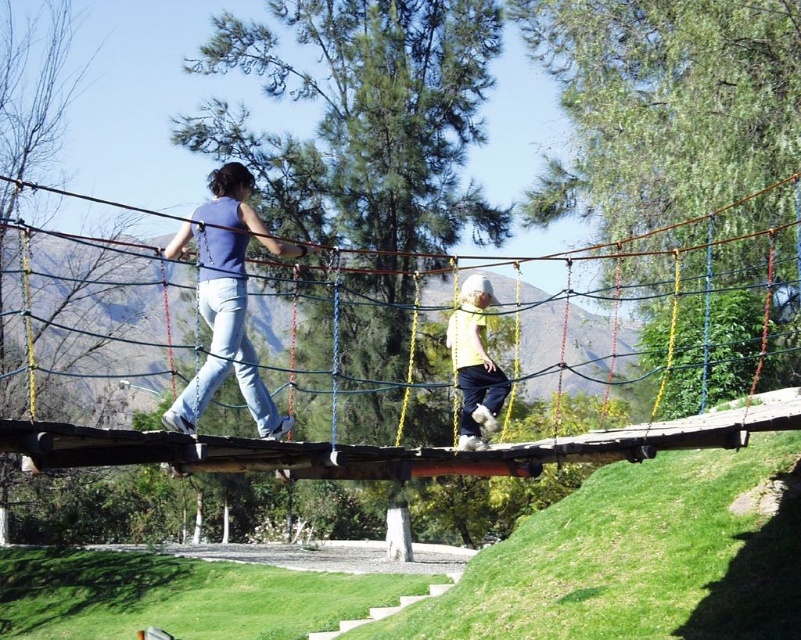
Question: Can you confirm if wooden suspension bridge at center is smaller than matte blue tank top at center?

Choices:
 (A) yes
 (B) no

Answer: (B)

Question: Is wooden suspension bridge at center positioned at the back of matte blue tank top at center?

Choices:
 (A) no
 (B) yes

Answer: (A)

Question: Which point is farther to the camera?

Choices:
 (A) 276,417
 (B) 467,296
 (C) 715,413

Answer: (C)

Question: Which object is the closest to the wooden suspension bridge at center?

Choices:
 (A) matte blue tank top at center
 (B) light yellow fabric at center

Answer: (A)

Question: Is wooden suspension bridge at center thinner than light yellow fabric at center?

Choices:
 (A) yes
 (B) no

Answer: (B)

Question: Which object appears farthest from the camera in this image?

Choices:
 (A) light yellow fabric at center
 (B) wooden suspension bridge at center
 (C) matte blue tank top at center

Answer: (A)